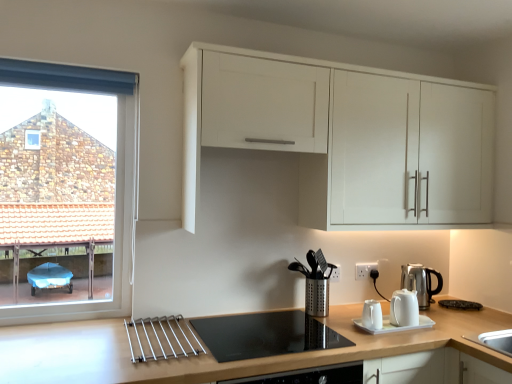
Question: Is black glass cooktop at center surrounding silver metallic kettle at right, arranged as the first kitchen appliance when viewed from the right?

Choices:
 (A) no
 (B) yes

Answer: (A)

Question: From the image's perspective, is black glass cooktop at center on top of silver metallic kettle at right, which is the 2th kitchen appliance in left-to-right order?

Choices:
 (A) yes
 (B) no

Answer: (B)

Question: Is black glass cooktop at center to the right of silver metallic kettle at right, which is the 2th kitchen appliance in left-to-right order, from the viewer's perspective?

Choices:
 (A) no
 (B) yes

Answer: (A)

Question: From a real-world perspective, is black glass cooktop at center on top of silver metallic kettle at right, which appears as the first kitchen appliance when viewed from the back?

Choices:
 (A) yes
 (B) no

Answer: (B)

Question: Does black glass cooktop at center have a larger size compared to silver metallic kettle at right, which appears as the first kitchen appliance when viewed from the back?

Choices:
 (A) no
 (B) yes

Answer: (B)

Question: Does point (309, 137) appear closer or farther from the camera than point (366, 264)?

Choices:
 (A) closer
 (B) farther

Answer: (A)

Question: From a real-world perspective, is white matte cabinet at upper center above or below white plastic electric outlet at lower right?

Choices:
 (A) above
 (B) below

Answer: (A)

Question: Would you say white matte cabinet at upper center is to the left or to the right of white plastic electric outlet at lower right in the picture?

Choices:
 (A) left
 (B) right

Answer: (A)

Question: Looking at the image, does white matte cabinet at upper center seem bigger or smaller compared to white plastic electric outlet at lower right?

Choices:
 (A) small
 (B) big

Answer: (B)

Question: Is white plastic electric outlet at lower right inside or outside of black glass cooktop at center?

Choices:
 (A) inside
 (B) outside

Answer: (B)

Question: Is point (366, 269) closer or farther from the camera than point (216, 357)?

Choices:
 (A) closer
 (B) farther

Answer: (B)

Question: Is white plastic electric outlet at lower right in front of or behind black glass cooktop at center in the image?

Choices:
 (A) behind
 (B) front

Answer: (A)

Question: In the image, is white plastic electric outlet at lower right on the left side or the right side of black glass cooktop at center?

Choices:
 (A) right
 (B) left

Answer: (A)

Question: In terms of size, does white plastic electric outlet at lower right appear bigger or smaller than silver metallic kettle at right, which is the 2th kitchen appliance in left-to-right order?

Choices:
 (A) small
 (B) big

Answer: (A)

Question: Based on their positions, is white plastic electric outlet at lower right located to the left or right of silver metallic kettle at right, arranged as the second kitchen appliance when viewed from the front?

Choices:
 (A) left
 (B) right

Answer: (A)